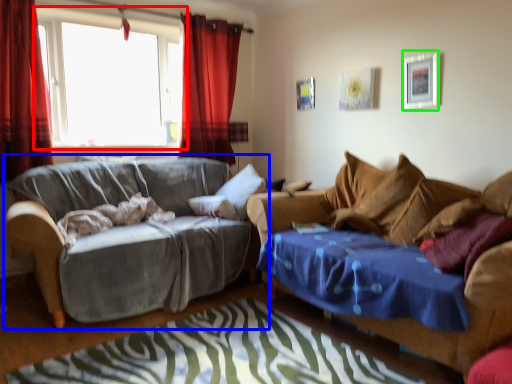
Question: Which object is the closest to the window (highlighted by a red box)? Choose among these: studio couch (highlighted by a blue box) or picture frame (highlighted by a green box).

Choices:
 (A) studio couch
 (B) picture frame

Answer: (A)